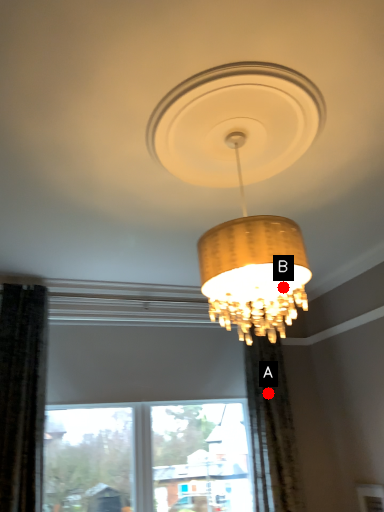
Question: Two points are circled on the image, labeled by A and B beside each circle. Which point is closer to the camera?

Choices:
 (A) A is closer
 (B) B is closer

Answer: (B)